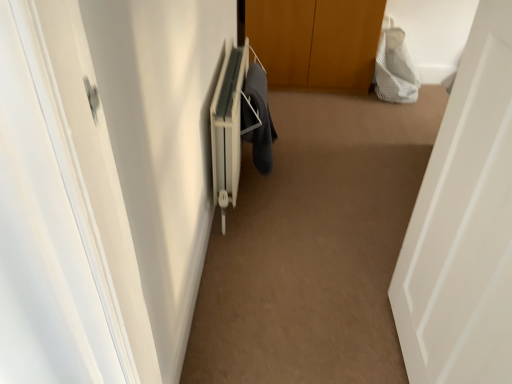
Question: From the image's perspective, relative to white matte door at right, is dark gray fabric at center above or below?

Choices:
 (A) below
 (B) above

Answer: (B)

Question: Is dark gray fabric at center wider or thinner than white matte door at right?

Choices:
 (A) wide
 (B) thin

Answer: (B)

Question: Based on their relative distances, which object is farther from the white matte door at right?

Choices:
 (A) white striped fabric at upper right
 (B) dark gray fabric at center

Answer: (A)

Question: Estimate the real-world distances between objects in this image. Which object is farther from the dark gray fabric at center?

Choices:
 (A) white matte door at right
 (B) white striped fabric at upper right

Answer: (B)